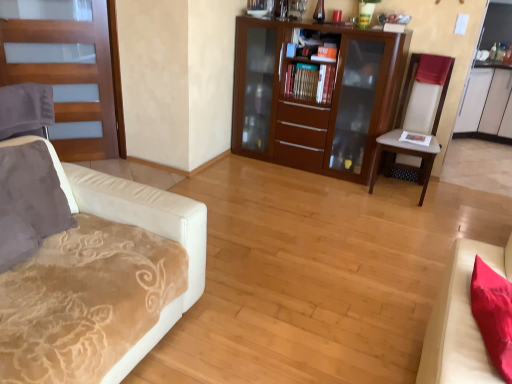
Where is `free spot in front of wooden cabinet at center`? The width and height of the screenshot is (512, 384). free spot in front of wooden cabinet at center is located at coordinates (x=303, y=203).